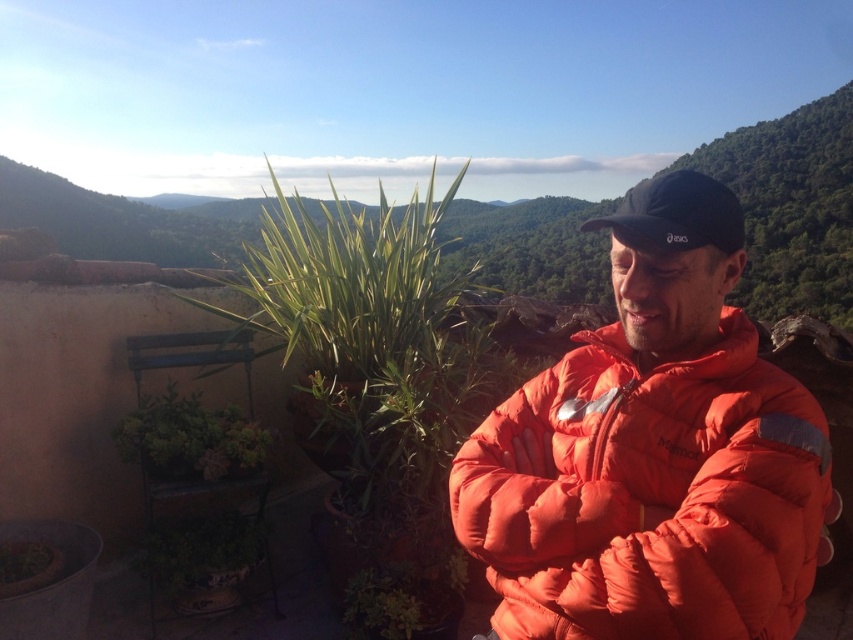
Question: Which point is closer to the camera?

Choices:
 (A) (183, 416)
 (B) (612, 532)

Answer: (B)

Question: Is orange down jacket at center wider than green succulent at lower left?

Choices:
 (A) yes
 (B) no

Answer: (A)

Question: Is green succulent at lower left to the left of black fabric baseball cap at upper right from the viewer's perspective?

Choices:
 (A) no
 (B) yes

Answer: (B)

Question: Which of the following is the closest to the observer?

Choices:
 (A) (718, 289)
 (B) (708, 220)
 (C) (234, 451)

Answer: (B)

Question: Which point is farther to the camera?

Choices:
 (A) orange down jacket at center
 (B) black fabric baseball cap at upper right

Answer: (B)

Question: Does orange down jacket at center have a greater width compared to black fabric baseball cap at upper right?

Choices:
 (A) yes
 (B) no

Answer: (A)